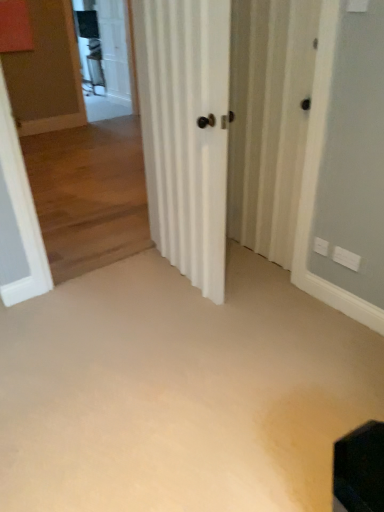
Locate an element on the screen. blank area to the left of white matte door at center is located at coordinates (123, 288).